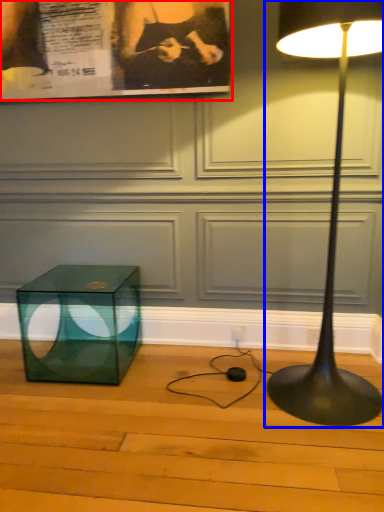
Question: Which object is closer to the camera taking this photo, poster page (highlighted by a red box) or lamp (highlighted by a blue box)?

Choices:
 (A) poster page
 (B) lamp

Answer: (B)